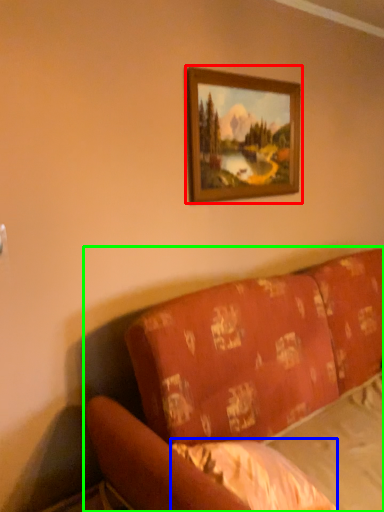
Question: Considering the real-world distances, which object is closest to picture frame (highlighted by a red box)? sheet (highlighted by a blue box) or studio couch (highlighted by a green box).

Choices:
 (A) sheet
 (B) studio couch

Answer: (B)